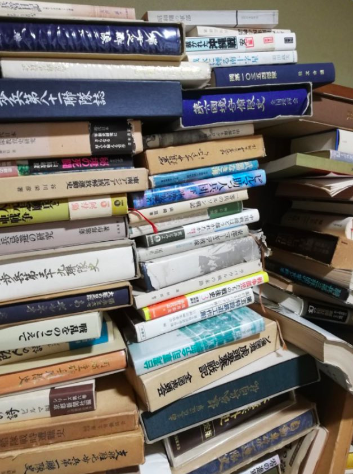
Locate an element on the screen. The height and width of the screenshot is (474, 353). yellow book right lower corner is located at coordinates (348, 461).